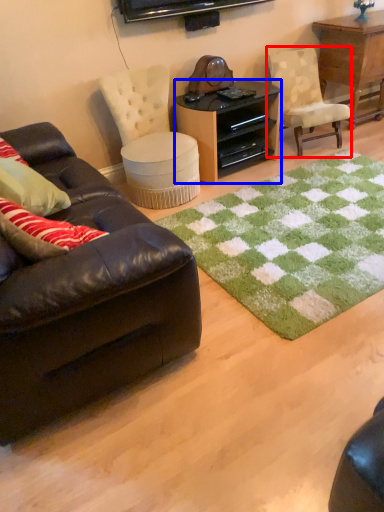
Question: Which point is closer to the camera, chair (highlighted by a red box) or desk (highlighted by a blue box)?

Choices:
 (A) chair
 (B) desk

Answer: (B)